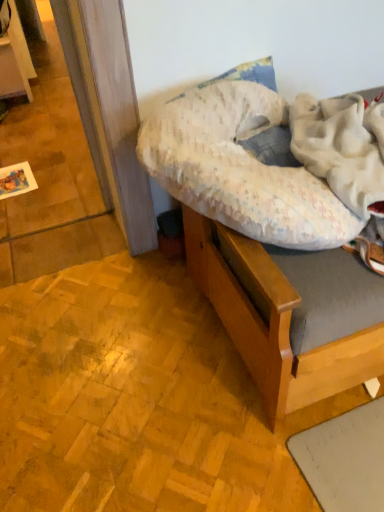
Question: Considering the relative positions of fluffy white pillow at center and wooden hospital bed at upper right in the image provided, is fluffy white pillow at center to the left of wooden hospital bed at upper right from the viewer's perspective?

Choices:
 (A) no
 (B) yes

Answer: (B)

Question: Are fluffy white pillow at center and wooden hospital bed at upper right far apart?

Choices:
 (A) no
 (B) yes

Answer: (A)

Question: Is the depth of fluffy white pillow at center greater than that of wooden hospital bed at upper right?

Choices:
 (A) no
 (B) yes

Answer: (A)

Question: Can wooden hospital bed at upper right be found inside fluffy white pillow at center?

Choices:
 (A) no
 (B) yes

Answer: (A)

Question: Considering the relative sizes of fluffy white pillow at center and wooden hospital bed at upper right in the image provided, is fluffy white pillow at center wider than wooden hospital bed at upper right?

Choices:
 (A) yes
 (B) no

Answer: (B)

Question: Does fluffy white pillow at center have a greater height compared to wooden hospital bed at upper right?

Choices:
 (A) no
 (B) yes

Answer: (A)

Question: Does wooden hospital bed at upper right contain fluffy white pillow at center?

Choices:
 (A) yes
 (B) no

Answer: (A)

Question: Is wooden hospital bed at upper right to the left of fluffy white pillow at center from the viewer's perspective?

Choices:
 (A) no
 (B) yes

Answer: (A)

Question: Considering the relative sizes of wooden hospital bed at upper right and fluffy white pillow at center in the image provided, is wooden hospital bed at upper right bigger than fluffy white pillow at center?

Choices:
 (A) no
 (B) yes

Answer: (B)

Question: From the image's perspective, is wooden hospital bed at upper right under fluffy white pillow at center?

Choices:
 (A) yes
 (B) no

Answer: (A)

Question: Does wooden hospital bed at upper right have a greater width compared to fluffy white pillow at center?

Choices:
 (A) yes
 (B) no

Answer: (A)

Question: Considering the relative sizes of wooden hospital bed at upper right and fluffy white pillow at center in the image provided, is wooden hospital bed at upper right smaller than fluffy white pillow at center?

Choices:
 (A) yes
 (B) no

Answer: (B)

Question: From the image's perspective, is fluffy white pillow at center located above or below wooden hospital bed at upper right?

Choices:
 (A) below
 (B) above

Answer: (B)